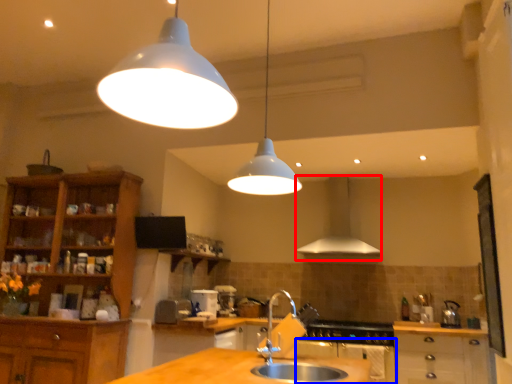
Question: Which of the following is the closest to the observer, exhaust hood (highlighted by a red box) or oven (highlighted by a blue box)?

Choices:
 (A) exhaust hood
 (B) oven

Answer: (B)